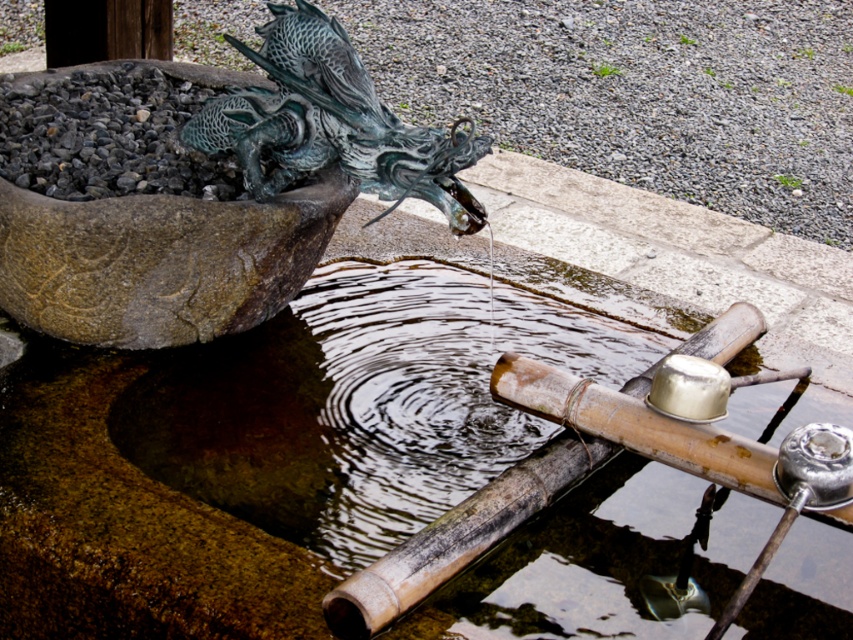
Question: Among these objects, which one is nearest to the camera?

Choices:
 (A) brown bamboo water feature at center
 (B) green patina metal dragon at upper left

Answer: (A)

Question: Which point appears farthest from the camera in this image?

Choices:
 (A) (228, 109)
 (B) (149, 461)

Answer: (A)

Question: Among these objects, which one is farthest from the camera?

Choices:
 (A) brown bamboo water feature at center
 (B) green patina metal dragon at upper left

Answer: (B)

Question: Does brown bamboo water feature at center have a larger size compared to green patina metal dragon at upper left?

Choices:
 (A) no
 (B) yes

Answer: (B)

Question: Does brown bamboo water feature at center appear under green patina metal dragon at upper left?

Choices:
 (A) yes
 (B) no

Answer: (A)

Question: Does brown bamboo water feature at center come in front of green patina metal dragon at upper left?

Choices:
 (A) no
 (B) yes

Answer: (B)